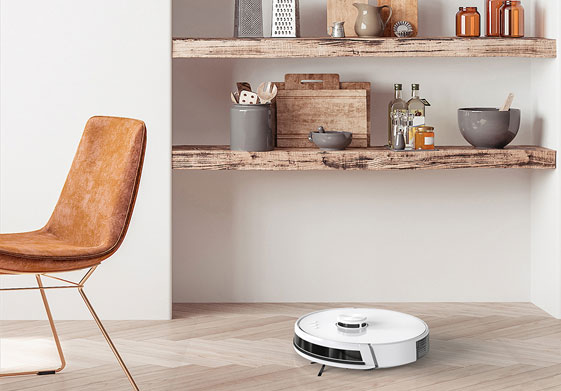
At what (x,y) coordinates should I click in order to perform the action: click on roomba. Please return your answer as a coordinate pair (x, y). Image resolution: width=561 pixels, height=391 pixels. Looking at the image, I should click on (395, 343).